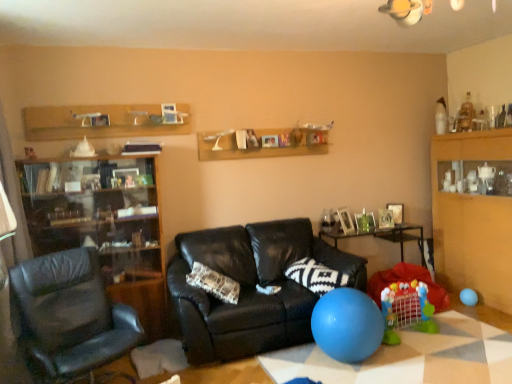
Question: From a real-world perspective, relative to blue rubber balloon at lower right, positioned as the 1th balloon in back-to-front order, is black leather couch at center vertically above or below?

Choices:
 (A) above
 (B) below

Answer: (A)

Question: Based on their sizes in the image, would you say black leather couch at center is bigger or smaller than blue rubber balloon at lower right, placed as the second balloon when sorted from left to right?

Choices:
 (A) small
 (B) big

Answer: (B)

Question: Estimate the real-world distances between objects in this image. Which object is farther from the blue rubber balloon at lower right, positioned as the 1th balloon in back-to-front order?

Choices:
 (A) blue rubber balloon at lower center, which is the second balloon in right-to-left order
 (B) matte black cabinet at left
 (C) wooden cabinet at right
 (D) wooden glossy table at center, which is counted as the 2th table, starting from the bottom
 (E) black and white patterned pillow at center

Answer: (B)

Question: Which object is the closest to the matte black cabinet at left?

Choices:
 (A) blue rubber balloon at lower center, the 1th balloon from the left
 (B) black leather chair at left
 (C) blue rubber ball at lower center, the first table from the front
 (D) black leather couch at center
 (E) black and white patterned pillow at center

Answer: (B)